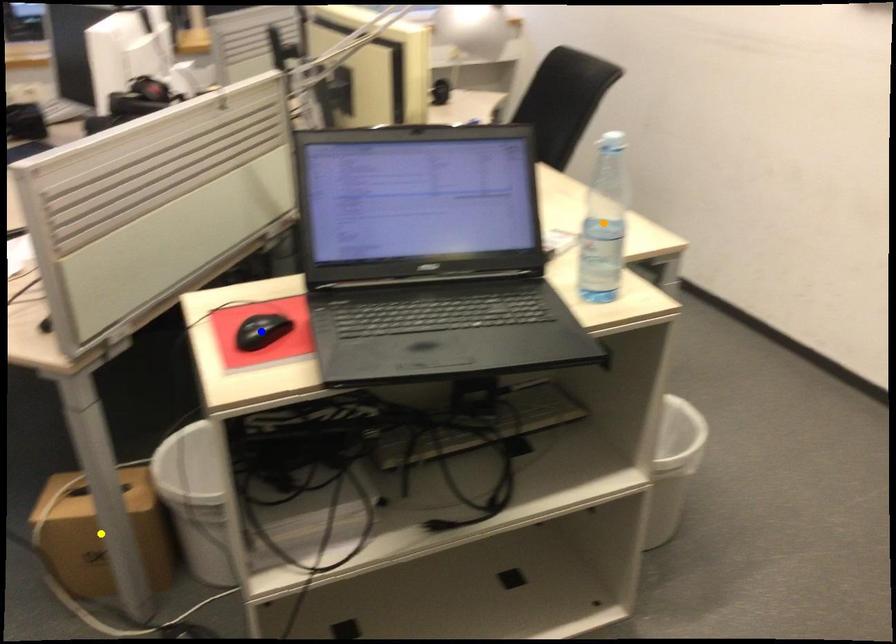
Order these from nearest to farthest:
yellow point | blue point | orange point

1. blue point
2. orange point
3. yellow point